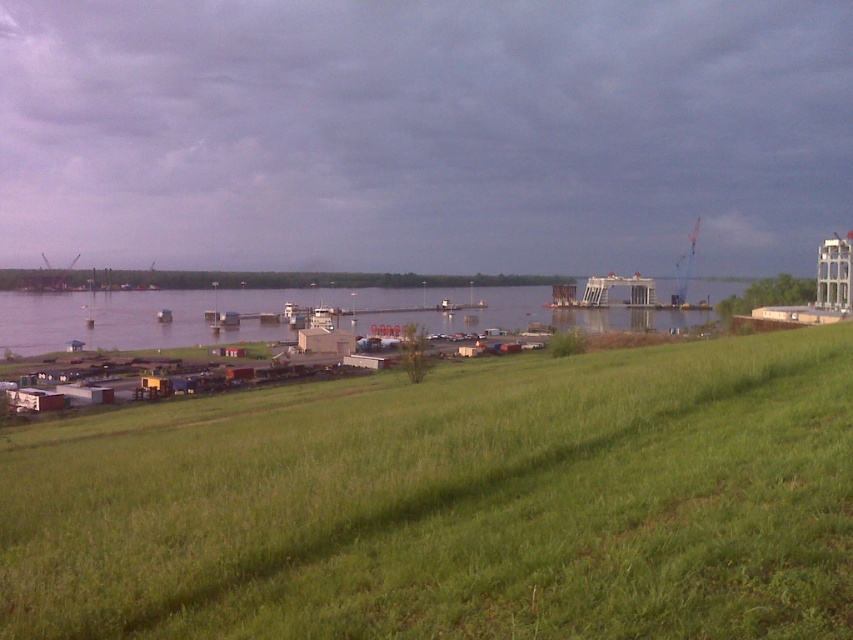
You are standing at the riverside and want to walk from the green grassy hillside at lower center to the clear water at center. Which direction should you move to reach the water?

You should move to the right to reach the clear water at center since the green grassy hillside at lower center is located to the left of it.

Consider the image. You are standing on the green grassy hillside at lower center and want to get to the clear water at center. Which direction should you walk to reach the water?

The clear water at center is higher in elevation than the green grassy hillside at lower center. Since the green grassy hillside at lower center is lower, you should walk upwards towards the clear water at center to reach it.

You are standing on the green grassy hillside at lower center and want to get to the clear water at center. Which direction should you walk to reach the water?

You should walk upwards towards the clear water at center because the green grassy hillside at lower center is located below it.